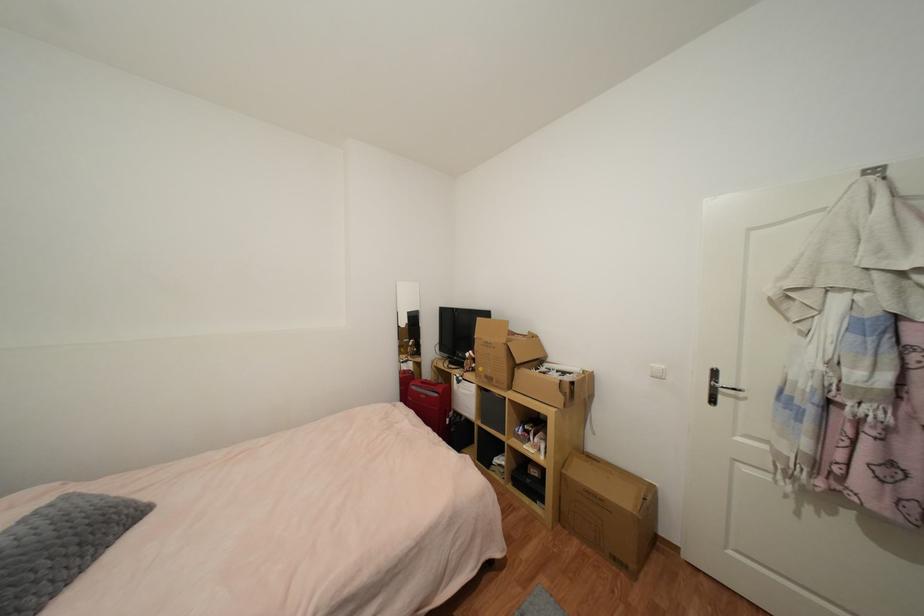
Find where to turn the silver door handle. Please return your answer as a coordinate pair (x, y).

(718, 387)